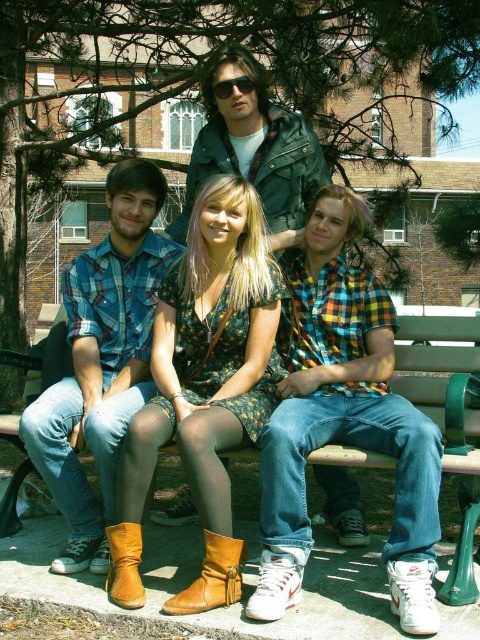
You are a photographer trying to capture a closeup of the plaid cotton shirt at center and the brown leather boot at lower center. Which object is positioned to the right side of the other?

The plaid cotton shirt at center is to the right of brown leather boot at lower center.

You are standing at the camera position and want to throw a ball to a point that is 7 meters away. Is the point at coordinates point (297,570) within the target distance?

The distance of point (297,570) from camera is 7.04 meters, so the point is slightly beyond the 7 meters target distance.